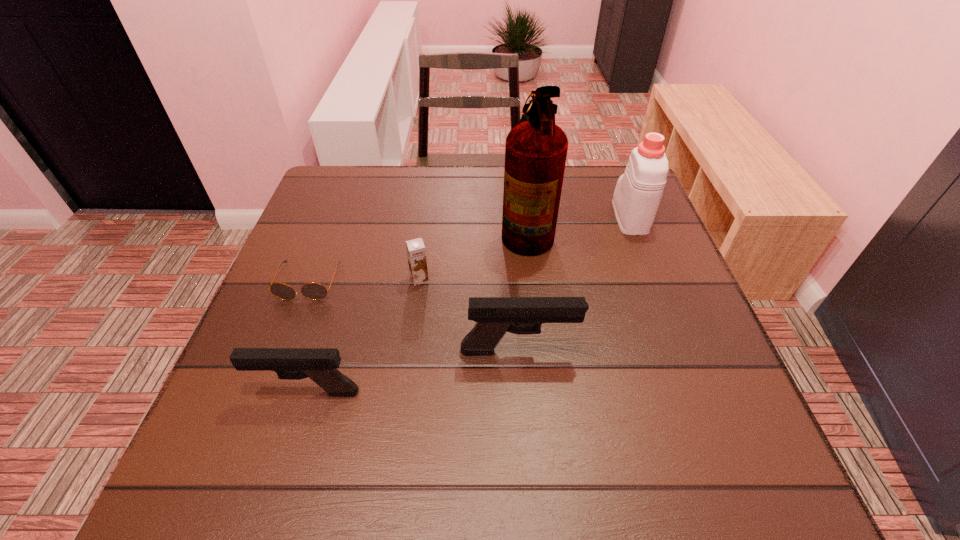
Find the location of a particular element. The width and height of the screenshot is (960, 540). vacant space at the near left corner of the desktop is located at coordinates (278, 419).

Image resolution: width=960 pixels, height=540 pixels. In order to click on free region at the far right corner of the desktop in this screenshot , I will do `click(591, 213)`.

Find the location of `free region at the near right corner of the desktop`. free region at the near right corner of the desktop is located at coordinates (711, 414).

The width and height of the screenshot is (960, 540). In order to click on free space between the farther pistol and the detergent in this screenshot , I will do `click(574, 284)`.

The height and width of the screenshot is (540, 960). I want to click on free spot between the shortest object and the second tallest object, so click(x=469, y=249).

Identify the location of vacant point located between the farther pistol and the fire extinguisher. The height and width of the screenshot is (540, 960). (522, 289).

Identify the location of blank region between the detergent and the shorter pistol. (468, 304).

Locate an element on the screen. The image size is (960, 540). empty space that is in between the fifth shortest object and the sunglasses is located at coordinates (469, 249).

Image resolution: width=960 pixels, height=540 pixels. I want to click on free area in between the chocolate milk and the shortest object, so click(364, 281).

I want to click on the closest object to the shorter pistol, so click(x=495, y=316).